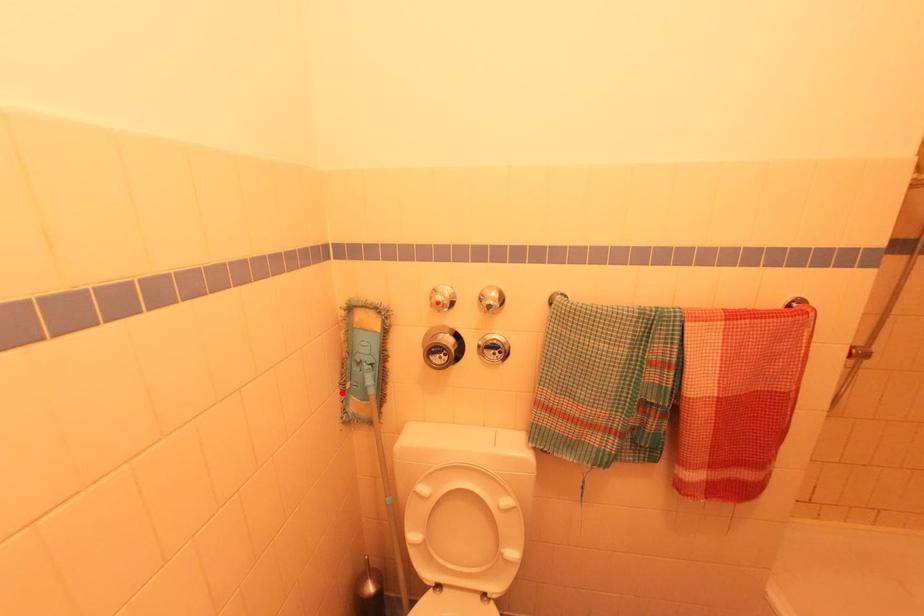
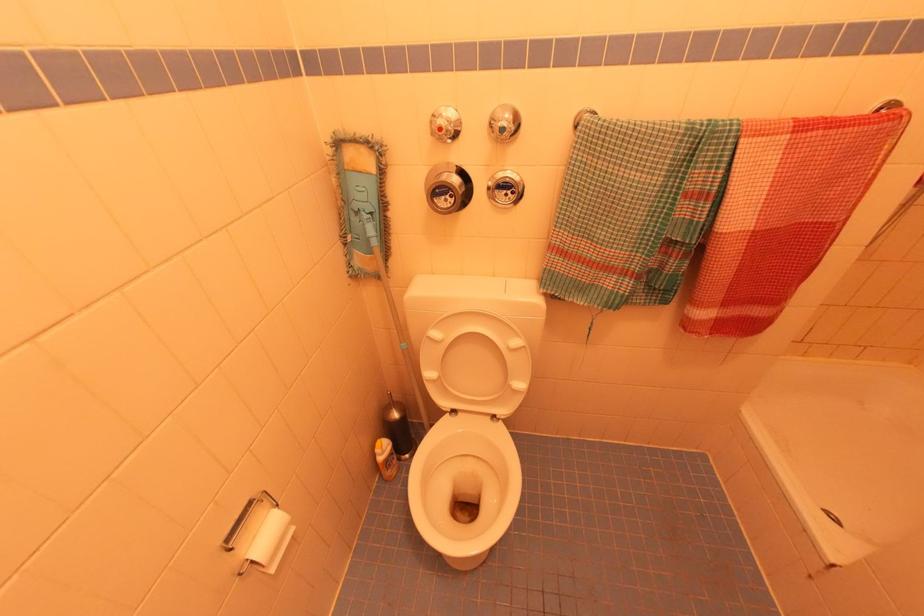
In the second image, find the point that corresponds to the highlighted location in the first image.

(344, 246)